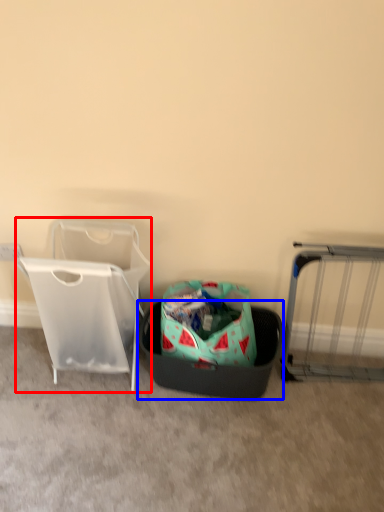
Question: Which point is closer to the camera, baby carriage (highlighted by a red box) or laundry basket (highlighted by a blue box)?

Choices:
 (A) baby carriage
 (B) laundry basket

Answer: (A)